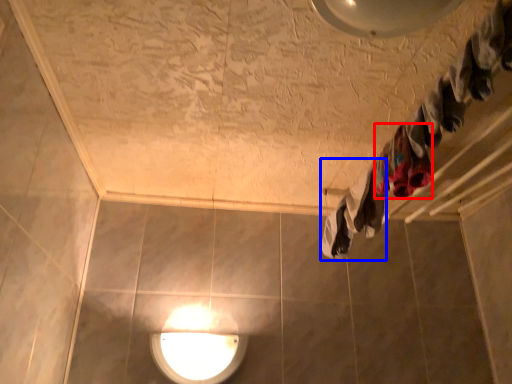
Question: Which object is closer to the camera taking this photo, clothing (highlighted by a red box) or clothing (highlighted by a blue box)?

Choices:
 (A) clothing
 (B) clothing

Answer: (A)